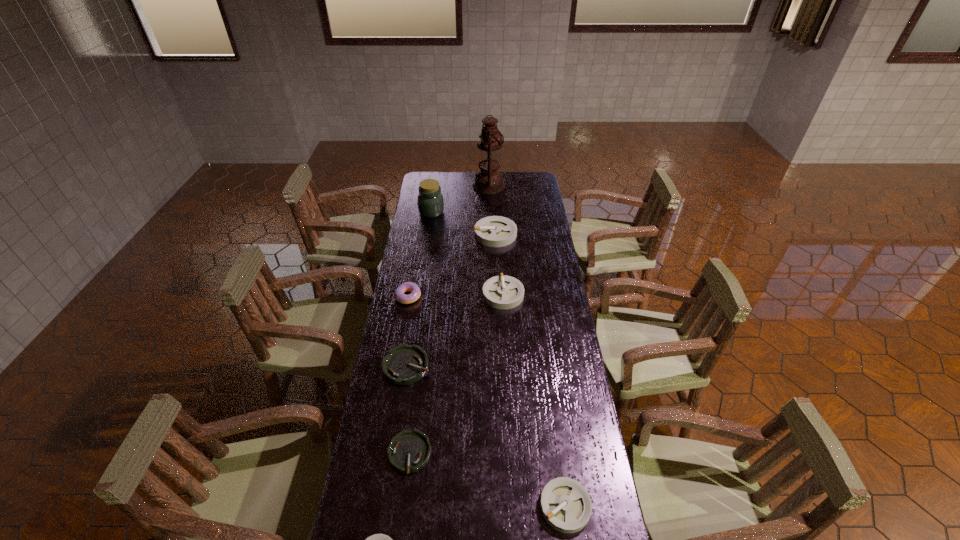
The width and height of the screenshot is (960, 540). I want to click on vacant region at the far right corner of the desktop, so click(x=540, y=176).

Where is `empty location between the farthest gray ashtray and the sixth tallest object`? The height and width of the screenshot is (540, 960). empty location between the farthest gray ashtray and the sixth tallest object is located at coordinates (530, 370).

Where is `free space between the fourth nearest ashtray and the fourth shortest ashtray`? This screenshot has width=960, height=540. free space between the fourth nearest ashtray and the fourth shortest ashtray is located at coordinates (486, 436).

Locate an element on the screen. free space that is in between the second farthest object and the tallest ashtray is located at coordinates (464, 223).

This screenshot has height=540, width=960. What are the coordinates of `vacant area that lies between the biggest gray ashtray and the second tallest object` in the screenshot? It's located at (464, 223).

I want to click on free space between the second nearest ashtray and the green jar, so click(x=498, y=359).

I want to click on free space that is in between the fourth farthest ashtray and the farthest ashtray, so click(452, 344).

This screenshot has height=540, width=960. What are the coordinates of `the fifth closest object to the second tallest ashtray` in the screenshot? It's located at (408, 451).

Choose which object is the seventh nearest neighbor to the pink doughnut. Please provide its 2D coordinates. Your answer should be formatted as a tuple, i.e. [(x, y)], where the tuple contains the x and y coordinates of a point satisfying the conditions above.

[(566, 506)]

Select which ashtray is the second closest to the second biggest gray ashtray. Please provide its 2D coordinates. Your answer should be formatted as a tuple, i.e. [(x, y)], where the tuple contains the x and y coordinates of a point satisfying the conditions above.

[(403, 365)]